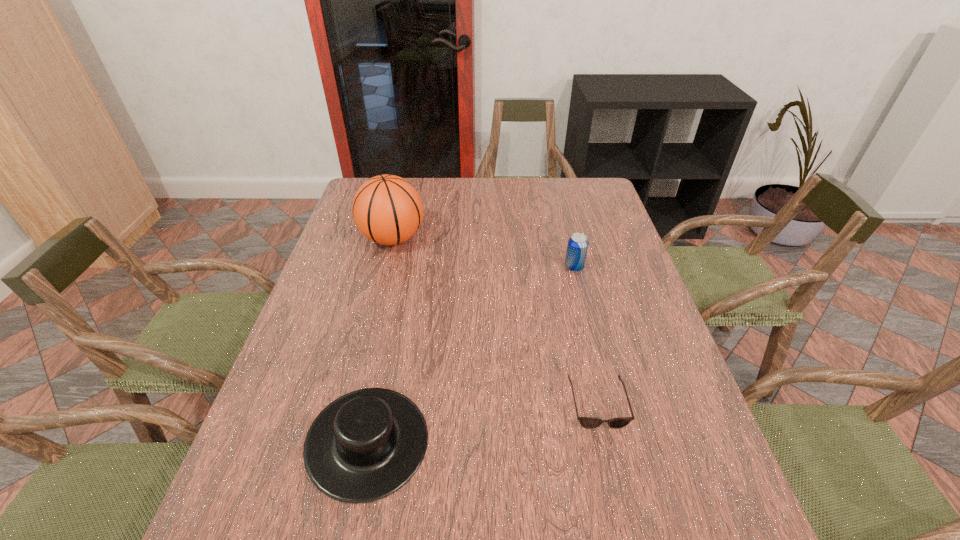
The height and width of the screenshot is (540, 960). I want to click on the tallest object, so click(387, 209).

Where is `the farthest object`? the farthest object is located at coordinates (387, 209).

Identify the location of beer can. This screenshot has width=960, height=540. tap(577, 247).

At what (x,y) coordinates should I click in order to perform the action: click on dress hat. Please return your answer as a coordinate pair (x, y). Looking at the image, I should click on (365, 445).

Locate an element on the screen. The width and height of the screenshot is (960, 540). sunglasses is located at coordinates (587, 422).

At what (x,y) coordinates should I click in order to perform the action: click on blank area located 0.180m on the front of the basketball. Please return your answer as a coordinate pair (x, y). Looking at the image, I should click on (377, 301).

Locate an element on the screen. free spot located on the left of the beer can is located at coordinates (503, 267).

The width and height of the screenshot is (960, 540). Find the location of `vacant space located 0.240m on the right of the dress hat`. vacant space located 0.240m on the right of the dress hat is located at coordinates (546, 442).

Image resolution: width=960 pixels, height=540 pixels. What are the coordinates of `blank space located on the front lenses of the shortest object` in the screenshot? It's located at (616, 488).

Identify the location of basketball that is at the left edge. The height and width of the screenshot is (540, 960). (387, 209).